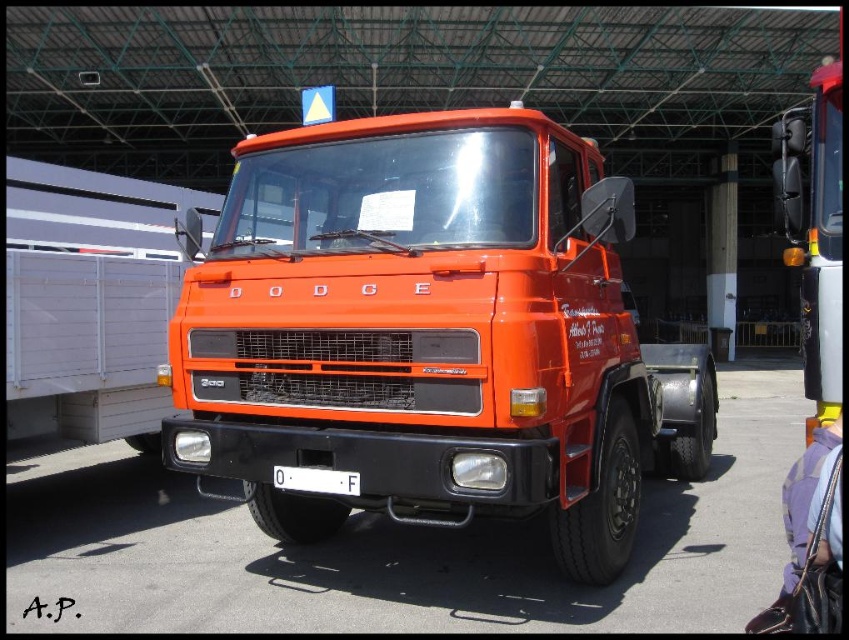
You are a photographer trying to capture the orange matte truck at center and the white plastic license plate at center in a single shot. Which object will appear bigger in the photo?

The orange matte truck at center will appear bigger in the photo because it has a larger size compared to the white plastic license plate at center.

You are standing in front of the orange matte truck at center and the white plastic license plate at center. Which object is positioned to the left?

The white plastic license plate at center is positioned to the left of the orange matte truck at center.

You are standing in front of the orange matte truck at center and want to place a sticker on the white plastic license plate at center. Can you reach the license plate without moving closer to the truck?

The orange matte truck at center is closer to the viewer than the white plastic license plate at center, so the license plate is farther away. If you are already standing in front of the truck, you might need to move slightly forward to reach the license plate unless you have an extended tool.